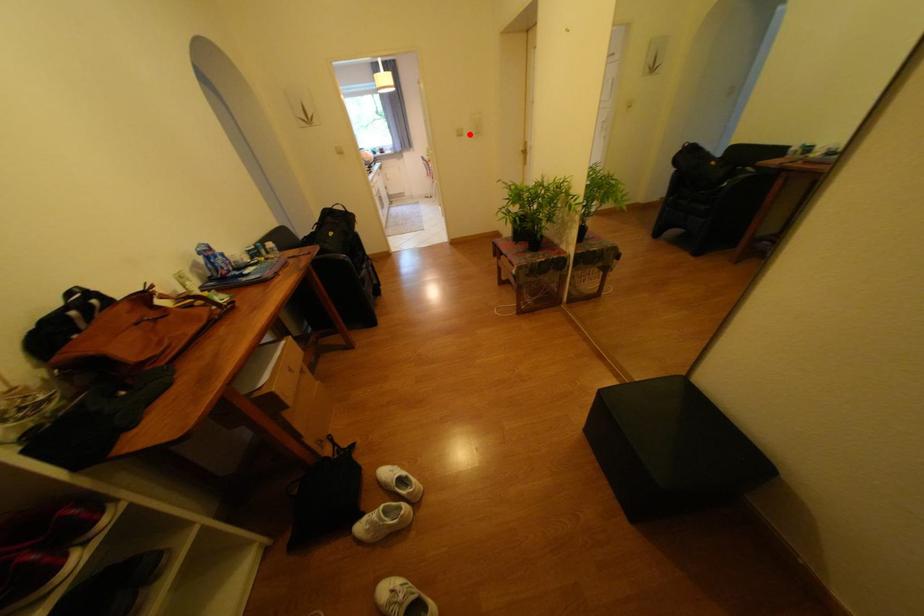
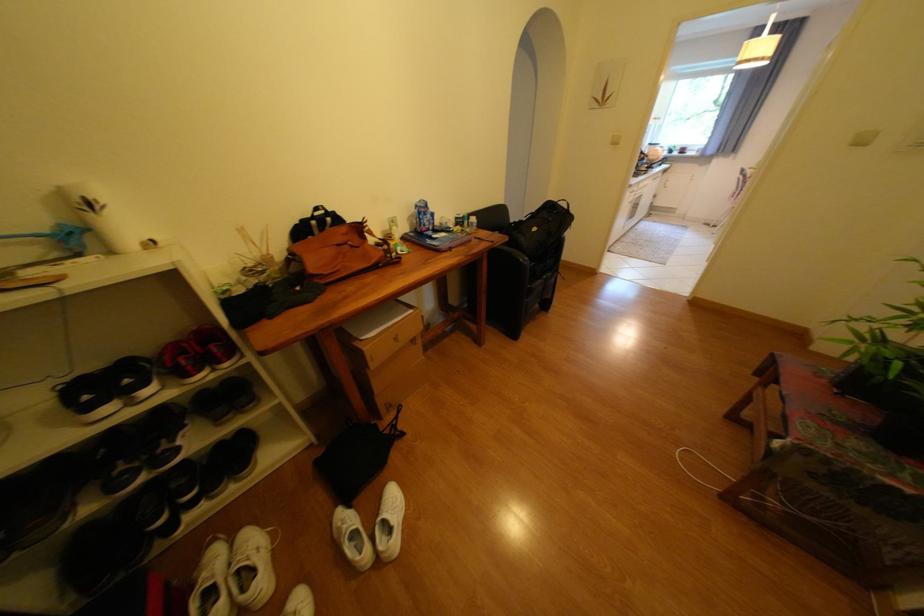
In the second image, find the point that corresponds to the highlighted location in the first image.

(872, 142)